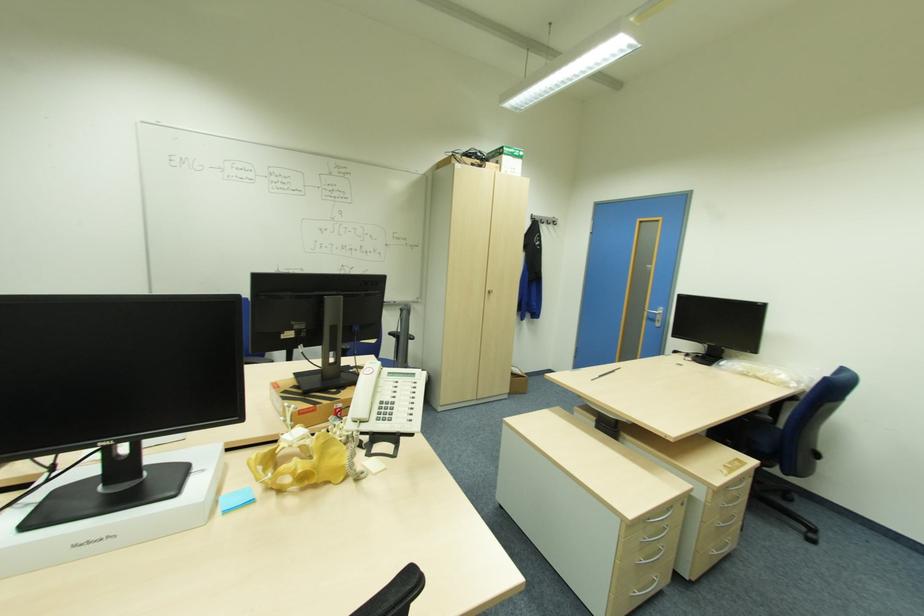
Locate an element on the screen. Image resolution: width=924 pixels, height=616 pixels. black pen is located at coordinates (604, 373).